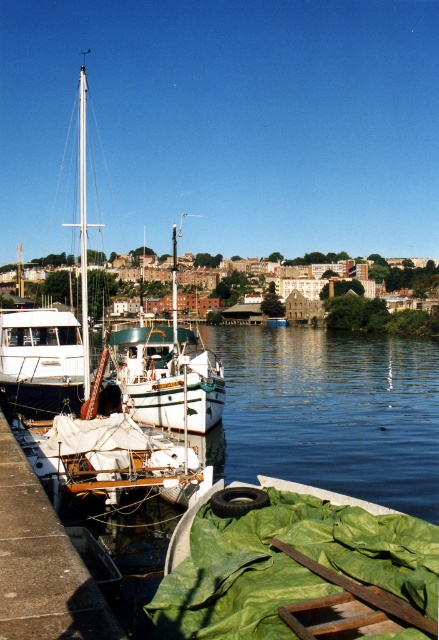
You are a dock worker who needs to secure a new boat cover over the white matte sailboat at left and the white glossy mast at left. Given that the mast is smaller than the sailboat, which object requires a larger cover?

The white matte sailboat at left requires a larger cover because it has a larger size compared to the white glossy mast at left.